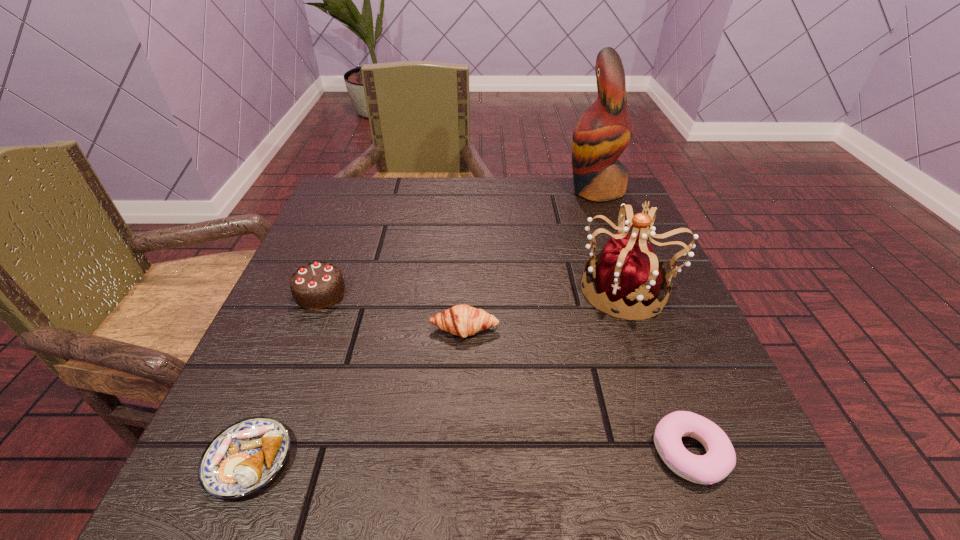
Where is `pastry present at the left edge`? The image size is (960, 540). pastry present at the left edge is located at coordinates (243, 458).

Identify the location of parrot situated at the right edge. (601, 135).

What are the coordinates of `tiara located at the right edge` in the screenshot? It's located at (627, 273).

I want to click on pastry positioned at the right edge, so click(720, 458).

At what (x,y) coordinates should I click in order to perform the action: click on object that is at the near left corner. Please return your answer as a coordinate pair (x, y). This screenshot has width=960, height=540. Looking at the image, I should click on (243, 458).

You are a GUI agent. You are given a task and a screenshot of the screen. Output one action in this format:
    pyautogui.click(x=<x>, y=<y>)
    Task: Click on the object present at the far right corner
    
    Given the screenshot: What is the action you would take?
    pyautogui.click(x=601, y=135)

Locate an element on the screen. The image size is (960, 540). object at the near right corner is located at coordinates pos(720,458).

Identify the location of vacant area at the far edge of the desktop. (439, 186).

The height and width of the screenshot is (540, 960). What are the coordinates of `vacant space at the near edge` in the screenshot? It's located at (539, 457).

Locate an element on the screen. The width and height of the screenshot is (960, 540). free space at the left edge of the desktop is located at coordinates (367, 253).